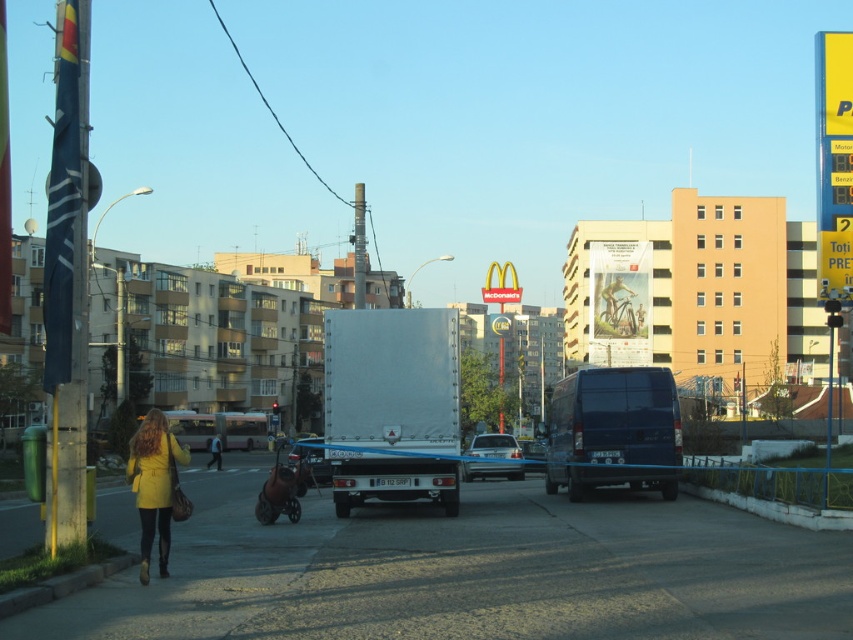
Between point (611, 378) and point (218, 461), which one is positioned behind?

Point (218, 461)

This screenshot has width=853, height=640. What do you see at coordinates (614, 417) in the screenshot?
I see `dark blue van at center` at bounding box center [614, 417].

You are a GUI agent. You are given a task and a screenshot of the screen. Output one action in this format:
    pyautogui.click(x=<x>, y=<y>)
    Task: Click on the dark blue van at center
    The height and width of the screenshot is (640, 853).
    Given the screenshot: What is the action you would take?
    pyautogui.click(x=614, y=417)

Does dark blue van at center appear on the left side of yellow matte coat at lower left?

Incorrect, dark blue van at center is not on the left side of yellow matte coat at lower left.

Is point (625, 388) in front of point (140, 513)?

No, it is not.

Is point (610, 404) positioned before point (154, 515)?

No, it is not.

Image resolution: width=853 pixels, height=640 pixels. I want to click on dark blue van at center, so click(x=614, y=417).

Is point (287, 472) closer to viewer compared to point (518, 452)?

Yes, it is in front of point (518, 452).

Consider the image. Does brown leather baby carriage at center have a greater width compared to blue metallic car at center?

Yes.

From the picture: Who is more forward, [270,474] or [503,440]?

Point [270,474]

Find the location of `brown leather baby carriage at center`. brown leather baby carriage at center is located at coordinates (279, 493).